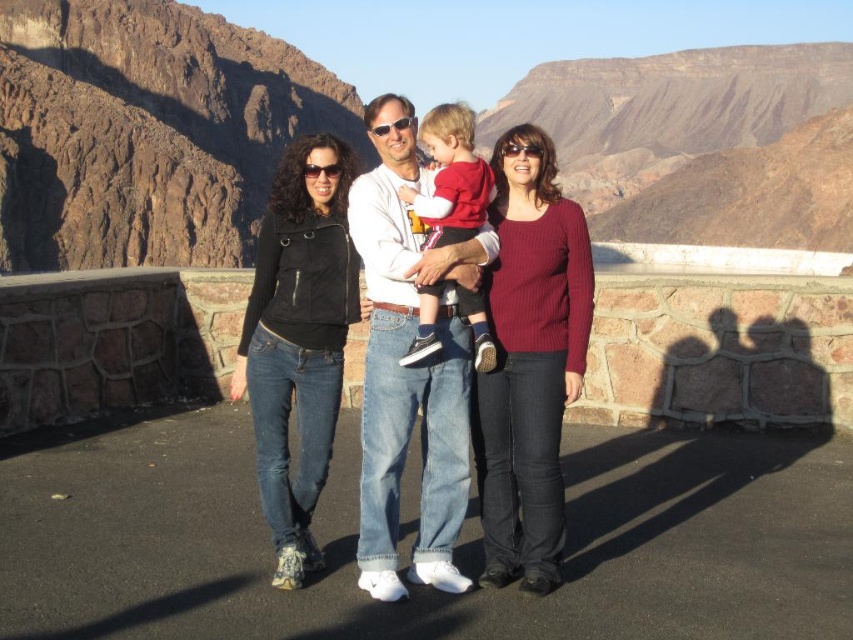
Between point (440, 522) and point (453, 154), which one is positioned in front?

Positioned in front is point (440, 522).

Does white cotton shirt at center have a lesser height compared to matte red sweater at center?

No.

Measure the distance between white cotton shirt at center and camera.

The distance of white cotton shirt at center from camera is 17.22 meters.

You are a GUI agent. You are given a task and a screenshot of the screen. Output one action in this format:
    pyautogui.click(x=<x>, y=<y>)
    Task: Click on the white cotton shirt at center
    This screenshot has width=853, height=640.
    Given the screenshot: What is the action you would take?
    pyautogui.click(x=410, y=365)

Which is more to the right, ribbed sweater at center or black leather jacket at center?

ribbed sweater at center is more to the right.

Is ribbed sweater at center positioned at the back of black leather jacket at center?

Yes, it is.

Measure the distance between point (567, 385) and camera.

The distance of point (567, 385) from camera is 19.48 meters.

Locate an element on the screen. ribbed sweater at center is located at coordinates (529, 362).

Does rugged rock formation at upper left appear on the left side of ribbed sweater at center?

Yes, rugged rock formation at upper left is to the left of ribbed sweater at center.

Is point (73, 234) positioned before point (538, 413)?

No, (73, 234) is behind (538, 413).

Identify the location of rugged rock formation at upper left. The width and height of the screenshot is (853, 640). (146, 131).